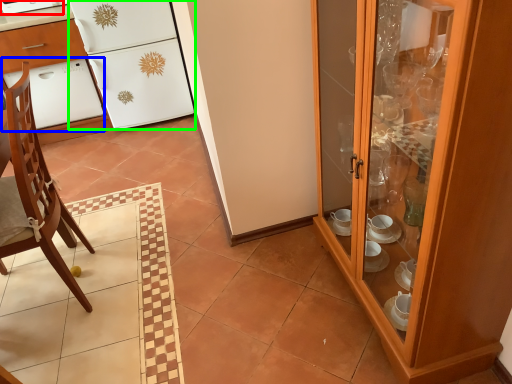
Question: Which object is the closest to the appliance (highlighted by a red box)? Choose among these: oven (highlighted by a blue box) or refrigerator (highlighted by a green box).

Choices:
 (A) oven
 (B) refrigerator

Answer: (A)